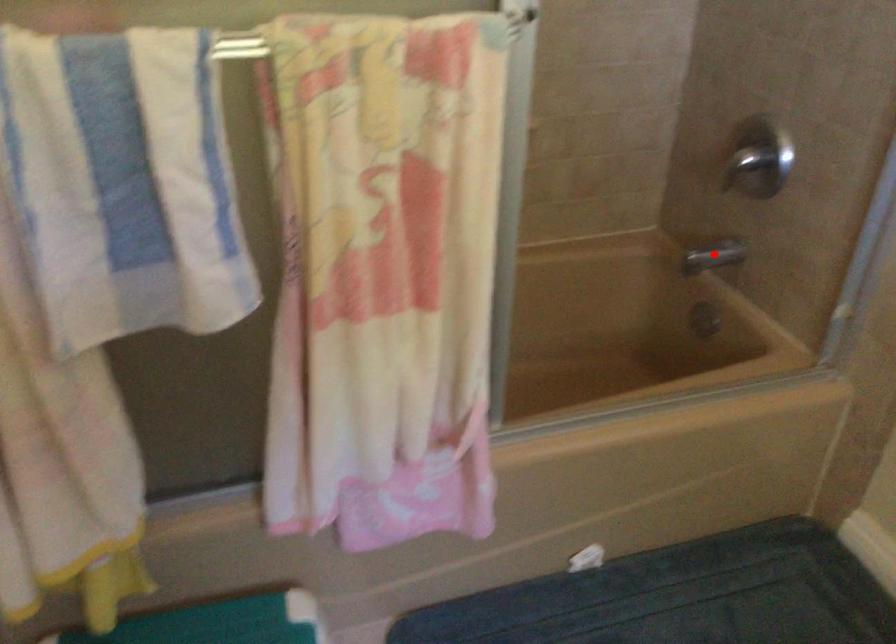
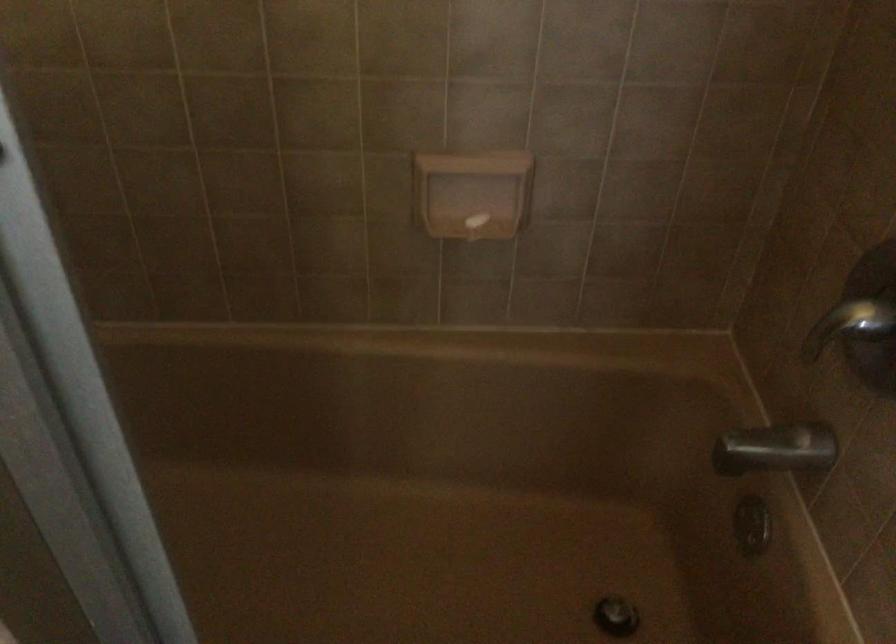
Question: I am providing you with two images of the same scene from different viewpoints. Given a red point in image1, look at the same physical point in image2. Is it:

Choices:
 (A) Closer to the viewpoint
 (B) Farther from the viewpoint

Answer: (A)